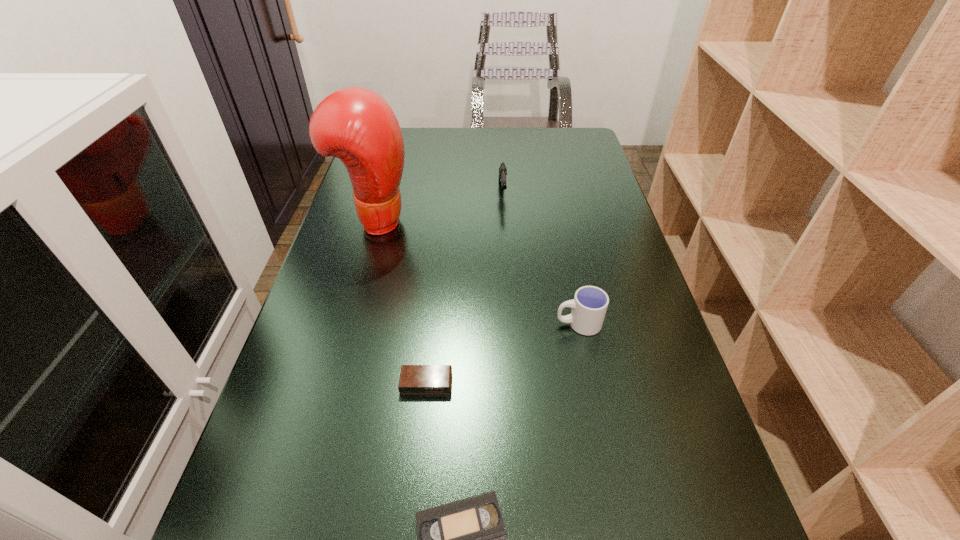
The width and height of the screenshot is (960, 540). Identify the location of boxing glove. (355, 124).

What are the coordinates of `the leftmost object` in the screenshot? It's located at (355, 124).

Where is `gun`? This screenshot has width=960, height=540. gun is located at coordinates (502, 169).

Identify the location of the third farthest object. Image resolution: width=960 pixels, height=540 pixels. (589, 306).

You are a GUI agent. You are given a task and a screenshot of the screen. Output one action in this format:
    pyautogui.click(x=<x>, y=<y>)
    Task: Click on the rightmost object
    The height and width of the screenshot is (540, 960).
    Given the screenshot: What is the action you would take?
    pyautogui.click(x=589, y=306)

Locate an element on the screen. The width and height of the screenshot is (960, 540). the second nearest object is located at coordinates (414, 379).

Where is `alarm clock`? The height and width of the screenshot is (540, 960). alarm clock is located at coordinates (414, 379).

At what (x,y) coordinates should I click in order to perform the action: click on free space located on the striking surface of the boxing glove. Please return your answer as a coordinate pair (x, y). Looking at the image, I should click on click(443, 220).

Find the location of a particular element. The image size is (960, 540). vacant area situated at the end of the barrel of the fourth object from left to right is located at coordinates (505, 225).

At what (x,y) coordinates should I click in order to perform the action: click on free region located with the handle on the side of the cup. Please return your answer as a coordinate pair (x, y). The width and height of the screenshot is (960, 540). Looking at the image, I should click on (389, 323).